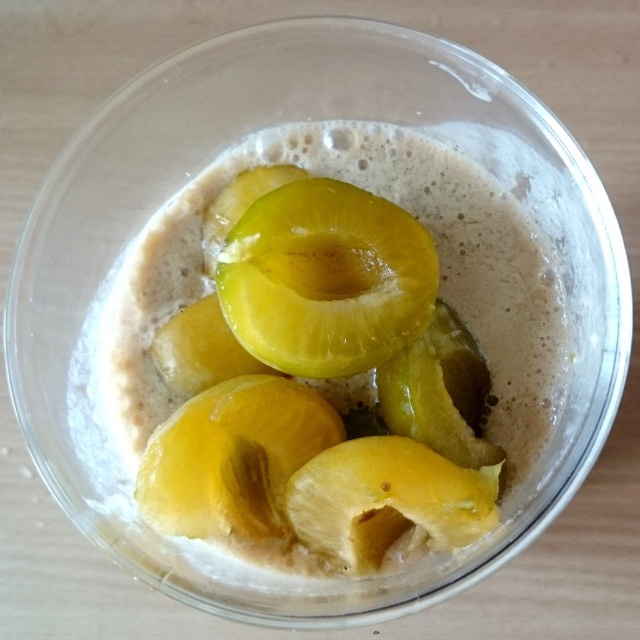
Is translucent yellow fruit at center further to camera compared to yellow translucent plum at center?

No, it is not.

Between point (264, 438) and point (273, 230), which one is positioned behind?

The point (273, 230) is behind.

Is point (316, 458) more distant than point (317, 193)?

No.

This screenshot has height=640, width=640. I want to click on translucent yellow fruit at center, so click(317, 378).

Is translucent yellow fruit at center taller than yellow matte fruit at center?

Yes.

The width and height of the screenshot is (640, 640). I want to click on translucent yellow fruit at center, so click(x=317, y=378).

Locate an element on the screen. translucent yellow fruit at center is located at coordinates (317, 378).

Between yellow translucent plum at center and yellow matte fruit at center, which one appears on the left side from the viewer's perspective?

yellow translucent plum at center is more to the left.

Does point (260, 337) come closer to viewer compared to point (358, 470)?

No, it is behind (358, 470).

Where is `yellow translucent plum at center`? This screenshot has height=640, width=640. yellow translucent plum at center is located at coordinates (324, 278).